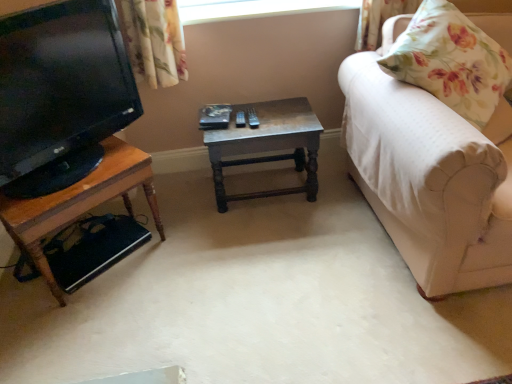
I want to click on woodenobject at left, the 1th table positioned from the left, so click(x=81, y=215).

Image resolution: width=512 pixels, height=384 pixels. What do you see at coordinates (451, 61) in the screenshot? I see `floral fabric pillow at right` at bounding box center [451, 61].

Locate an element on the screen. woodenobject at left, the 1th table positioned from the left is located at coordinates (81, 215).

From a real-world perspective, between transparent glass window at upper center and woodenobject at left, the 1th table positioned from the left, who is vertically higher?

transparent glass window at upper center, from a real-world perspective.

Considering the sizes of transparent glass window at upper center and woodenobject at left, the 1th table positioned from the left, in the image, is transparent glass window at upper center taller or shorter than woodenobject at left, the 1th table positioned from the left,?

transparent glass window at upper center is shorter than woodenobject at left, the 1th table positioned from the left.

Does transparent glass window at upper center turn towards woodenobject at left, arranged as the second table when viewed from the right?

No, transparent glass window at upper center is not turned towards woodenobject at left, arranged as the second table when viewed from the right.

Choose the correct answer: Is transparent glass window at upper center inside woodenobject at left, arranged as the second table when viewed from the right, or outside it?

transparent glass window at upper center is not inside woodenobject at left, arranged as the second table when viewed from the right, it's outside.

Is woodenobject at left, arranged as the second table when viewed from the right, aimed at wooden table at center, positioned as the second table in left-to-right order?

No, woodenobject at left, arranged as the second table when viewed from the right, is not facing towards wooden table at center, positioned as the second table in left-to-right order.

The image size is (512, 384). Find the location of `table in front of the wooden table at center, positioned as the second table in left-to-right order`. table in front of the wooden table at center, positioned as the second table in left-to-right order is located at coordinates (81, 215).

Which is more to the left, woodenobject at left, the 1th table positioned from the left, or wooden table at center, acting as the first table starting from the right?

From the viewer's perspective, woodenobject at left, the 1th table positioned from the left, appears more on the left side.

Which object is wider, wooden table at center, acting as the first table starting from the right, or transparent glass window at upper center?

wooden table at center, acting as the first table starting from the right, is wider.

From a real-world perspective, is wooden table at center, acting as the first table starting from the right, physically located above or below transparent glass window at upper center?

wooden table at center, acting as the first table starting from the right, is situated lower than transparent glass window at upper center in the real world.

How different are the orientations of wooden table at center, positioned as the second table in left-to-right order, and transparent glass window at upper center in degrees?

The facing directions of wooden table at center, positioned as the second table in left-to-right order, and transparent glass window at upper center are 1.59 degrees apart.

Which of these two, wooden table at center, acting as the first table starting from the right, or transparent glass window at upper center, is bigger?

With larger size is wooden table at center, acting as the first table starting from the right.

Does wooden table at center, acting as the first table starting from the right, have a lesser width compared to woodenobject at left, the 1th table positioned from the left?

Yes, wooden table at center, acting as the first table starting from the right, is thinner than woodenobject at left, the 1th table positioned from the left.

From the picture: From the image's perspective, is wooden table at center, acting as the first table starting from the right, located beneath woodenobject at left, arranged as the second table when viewed from the right?

No, from the image's perspective, wooden table at center, acting as the first table starting from the right, is not below woodenobject at left, arranged as the second table when viewed from the right.

Are wooden table at center, positioned as the second table in left-to-right order, and woodenobject at left, arranged as the second table when viewed from the right, beside each other?

wooden table at center, positioned as the second table in left-to-right order, is not next to woodenobject at left, arranged as the second table when viewed from the right, and they're not touching.

Where is `studio couch on the right of matte black tv at left`? The width and height of the screenshot is (512, 384). studio couch on the right of matte black tv at left is located at coordinates (431, 179).

Considering the sizes of objects white fabric couch at right and matte black tv at left in the image provided, who is smaller, white fabric couch at right or matte black tv at left?

With smaller size is matte black tv at left.

How different are the orientations of white fabric couch at right and matte black tv at left in degrees?

There is a 42.1-degree angle between the facing directions of white fabric couch at right and matte black tv at left.

Could you tell me if white fabric couch at right is facing matte black tv at left?

No, white fabric couch at right is not aimed at matte black tv at left.

Can you see floral fabric pillow at right touching transparent glass window at upper center?

No, floral fabric pillow at right is not next to transparent glass window at upper center.

From the image's perspective, is floral fabric pillow at right located above or below transparent glass window at upper center?

From the image's perspective, floral fabric pillow at right appears below transparent glass window at upper center.

Between floral fabric pillow at right and transparent glass window at upper center, which one has larger width?

floral fabric pillow at right is wider.

Who is more distant, woodenobject at left, the 1th table positioned from the left, or transparent glass window at upper center?

transparent glass window at upper center.

Which is behind, point (83, 276) or point (188, 3)?

The point (188, 3) is more distant.

From the image's perspective, who appears lower, woodenobject at left, arranged as the second table when viewed from the right, or transparent glass window at upper center?

woodenobject at left, arranged as the second table when viewed from the right.

The height and width of the screenshot is (384, 512). I want to click on window screen located behind the woodenobject at left, the 1th table positioned from the left, so point(253,8).

Find the location of `table that appears on the left of wooden table at center, positioned as the second table in left-to-right order`. table that appears on the left of wooden table at center, positioned as the second table in left-to-right order is located at coordinates (81, 215).

When comparing their distances from transparent glass window at upper center, does woodenobject at left, arranged as the second table when viewed from the right, or floral fabric pillow at right seem further?

woodenobject at left, arranged as the second table when viewed from the right, lies further to transparent glass window at upper center than the other object.

When comparing their distances from woodenobject at left, arranged as the second table when viewed from the right, does matte black tv at left or transparent glass window at upper center seem closer?

matte black tv at left is positioned closer to the anchor woodenobject at left, arranged as the second table when viewed from the right.

Based on the photo, which object lies further to the anchor point woodenobject at left, the 1th table positioned from the left, wooden table at center, positioned as the second table in left-to-right order, or floral fabric pillow at right?

The object further to woodenobject at left, the 1th table positioned from the left, is floral fabric pillow at right.

Based on their spatial positions, is matte black tv at left or floral fabric pillow at right further from woodenobject at left, the 1th table positioned from the left?

Based on the image, floral fabric pillow at right appears to be further to woodenobject at left, the 1th table positioned from the left.

Based on their spatial positions, is white fabric couch at right or matte black tv at left further from wooden table at center, positioned as the second table in left-to-right order?

matte black tv at left is further to wooden table at center, positioned as the second table in left-to-right order.

From the image, which object appears to be farther from wooden table at center, positioned as the second table in left-to-right order, white fabric couch at right or woodenobject at left, the 1th table positioned from the left?

Based on the image, woodenobject at left, the 1th table positioned from the left, appears to be further to wooden table at center, positioned as the second table in left-to-right order.

Based on the photo, from the image, which object appears to be farther from wooden table at center, positioned as the second table in left-to-right order, transparent glass window at upper center or matte black tv at left?

Among the two, matte black tv at left is located further to wooden table at center, positioned as the second table in left-to-right order.

Based on their spatial positions, is white fabric couch at right or wooden table at center, acting as the first table starting from the right, closer to transparent glass window at upper center?

Among the two, wooden table at center, acting as the first table starting from the right, is located nearer to transparent glass window at upper center.

Identify the location of window screen between woodenobject at left, arranged as the second table when viewed from the right, and floral fabric pillow at right. (253, 8).

Identify the location of table between transparent glass window at upper center and woodenobject at left, the 1th table positioned from the left, from top to bottom. This screenshot has height=384, width=512. (267, 145).

Identify the location of table between woodenobject at left, arranged as the second table when viewed from the right, and white fabric couch at right. (267, 145).

In order to click on television situated between woodenobject at left, the 1th table positioned from the left, and floral fabric pillow at right from left to right in this screenshot , I will do `click(61, 94)`.